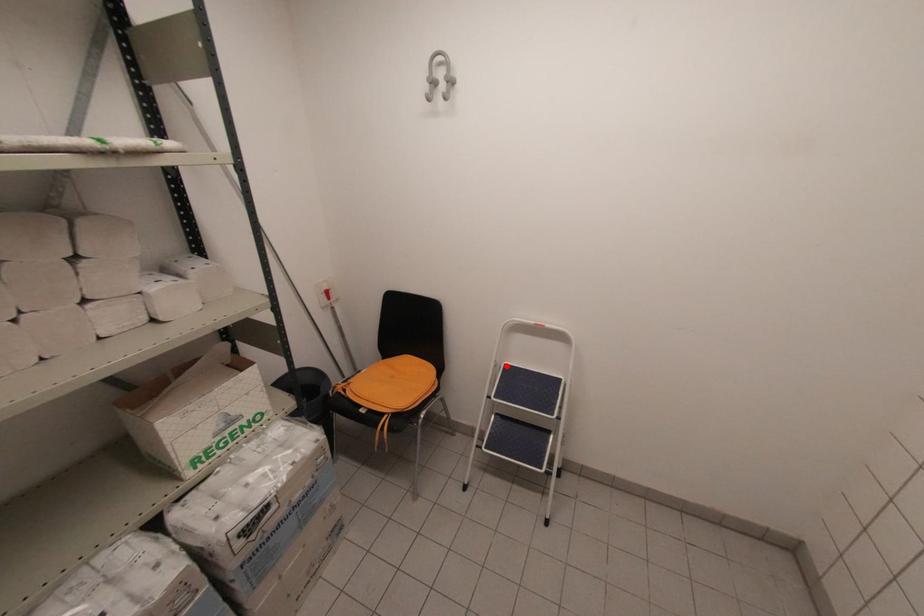
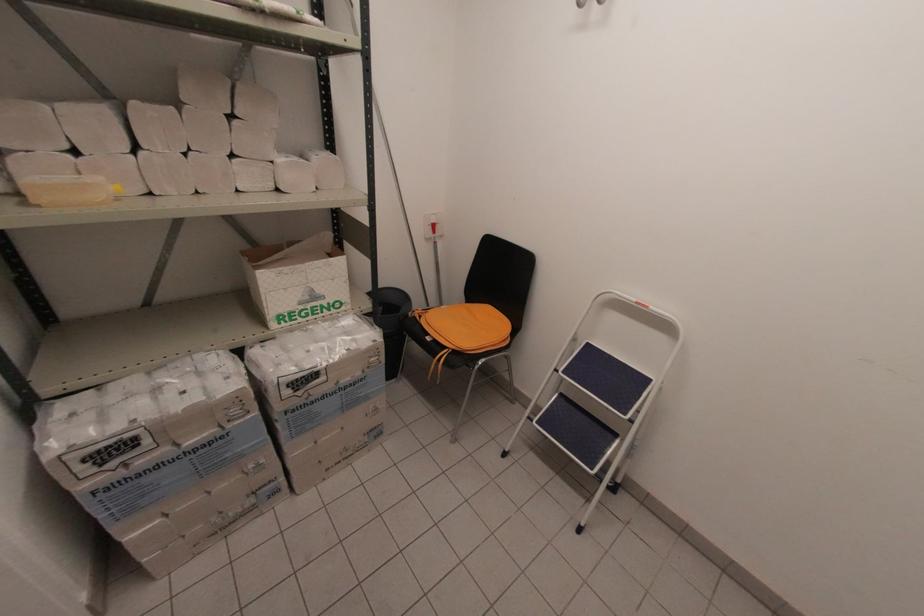
The point at the highlighted location is marked in the first image. Where is the corresponding point in the second image?

(589, 344)